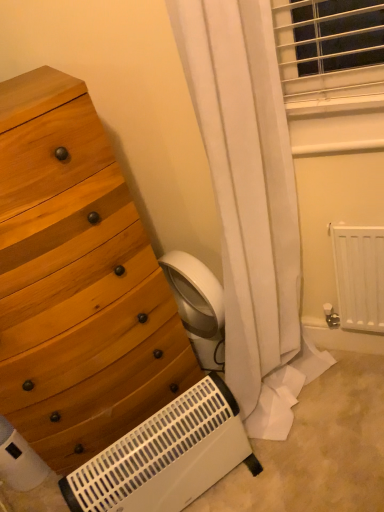
The image size is (384, 512). Identify the location of vacant area to the right of white plastic heater at lower center. point(300,466).